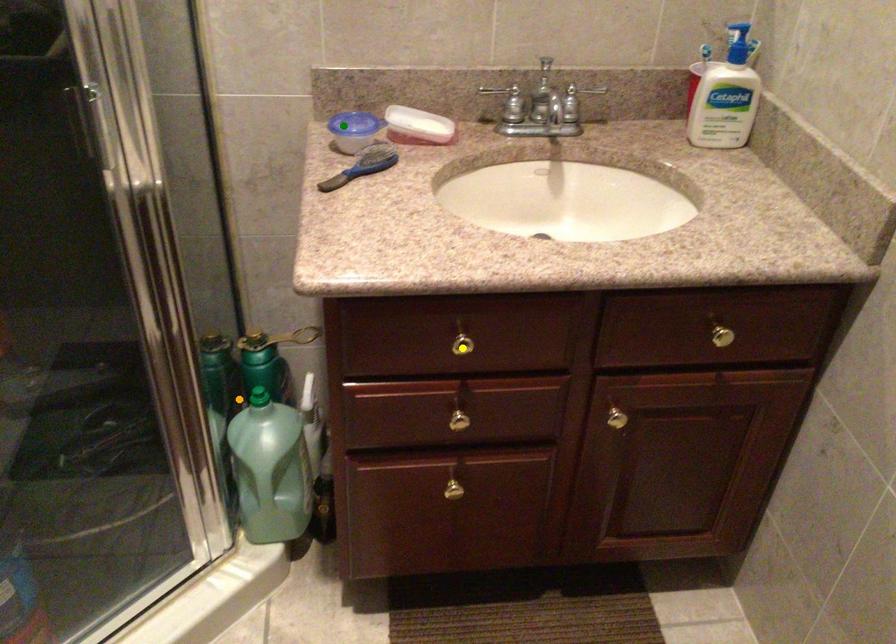
Order these from nearest to farthest:
A) yellow point
B) green point
C) orange point

yellow point, green point, orange point